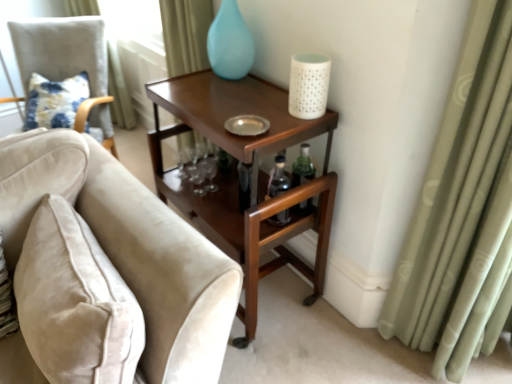
Question: Do you think light green fabric curtain at upper left, which is the 2th curtain from front to back, is within mahogany wood side table at upper right, or outside of it?

Choices:
 (A) outside
 (B) inside

Answer: (A)

Question: Considering the positions of point (197, 66) and point (304, 266), is point (197, 66) closer or farther from the camera than point (304, 266)?

Choices:
 (A) closer
 (B) farther

Answer: (A)

Question: Based on their relative distances, which object is nearer to the matte blue glass vase at upper center?

Choices:
 (A) green fabric curtain at right, the 2th curtain when ordered from left to right
 (B) velvet beige chair at left, acting as the second chair starting from the front
 (C) light green fabric curtain at upper left, the 2th curtain in the bottom-to-top sequence
 (D) white textured candle at upper right
 (E) floral fabric cushion at left

Answer: (C)

Question: Considering the real-world distances, which object is closest to the velvet beige chair at left, acting as the second chair starting from the front?

Choices:
 (A) velvet beige sofa at left, acting as the first chair starting from the front
 (B) matte blue glass vase at upper center
 (C) light green fabric curtain at upper left, arranged as the second curtain when viewed from the right
 (D) white textured candle at upper right
 (E) floral fabric cushion at left

Answer: (E)